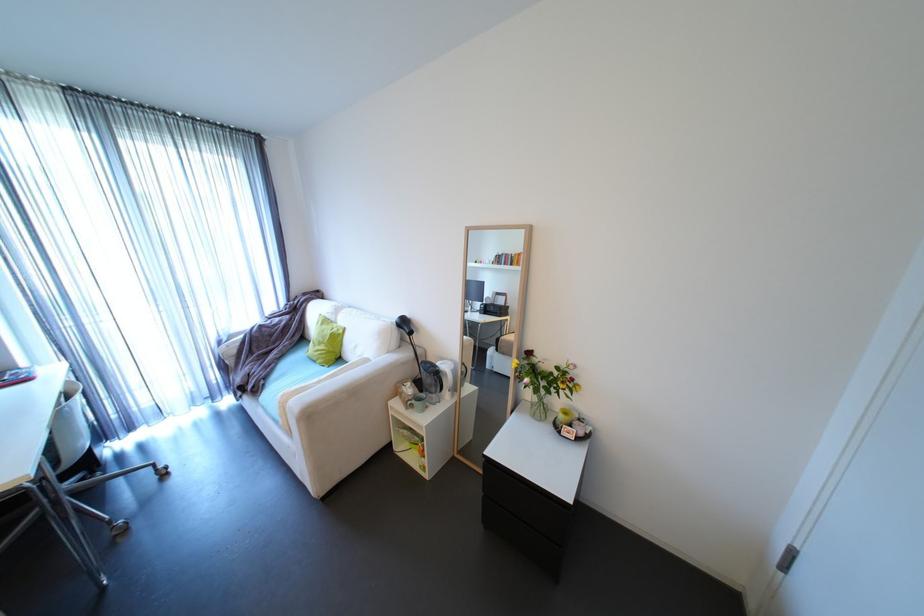
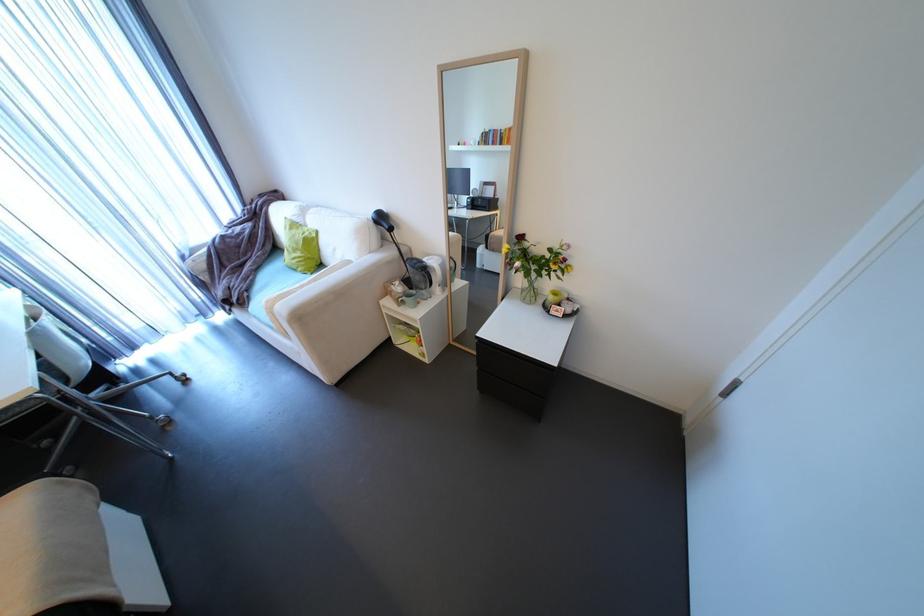
The point at [261,390] is marked in the first image. Where is the corresponding point in the second image?

(248, 302)